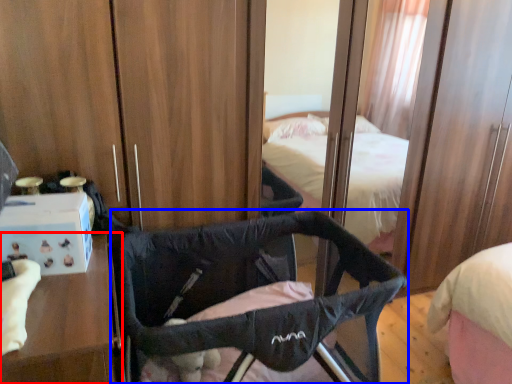
Question: Which object is closer to the camera taking this photo, furniture (highlighted by a red box) or infant bed (highlighted by a blue box)?

Choices:
 (A) furniture
 (B) infant bed

Answer: (A)